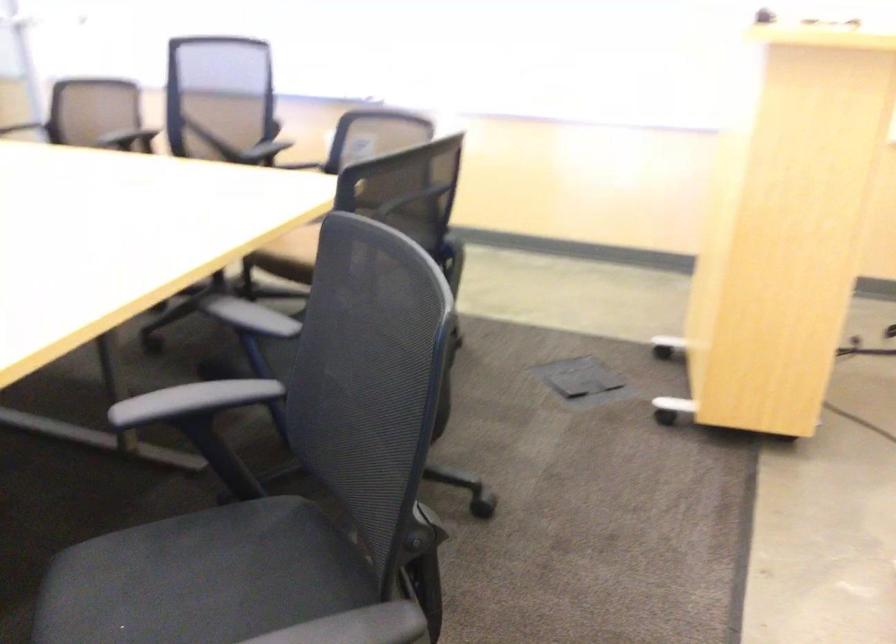
Where is `brown chair sitting surface`? This screenshot has width=896, height=644. brown chair sitting surface is located at coordinates (300, 243).